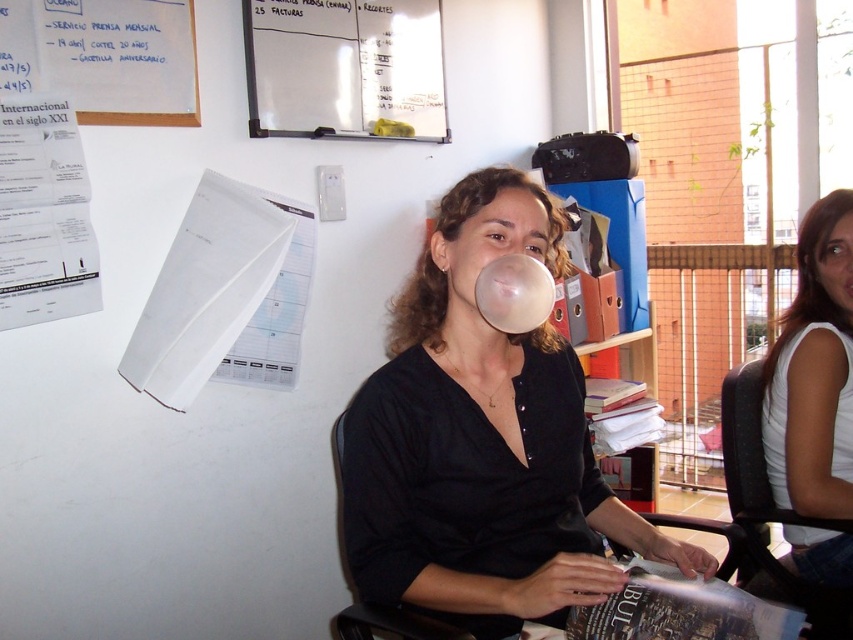
You are a tailor measuring clothes for a customer. You need to determine if the matte black shirt at center and the white cotton tank top at right can be placed side by side on a 1.2 meter wide hanger rack. Can they fit?

The matte black shirt at center and the white cotton tank top at right are 66.42 centimeters apart. Since the total required space is 66.42 cm and the rack is 120 cm wide, they can fit comfortably with extra space remaining.

Consider the image. You are an office worker who needs to sit down. You see the white cotton tank top at right and the black fabric chair at center. Which object is closer to you if you are standing in front of the desk?

The white cotton tank top at right is closer to you because the black fabric chair at center is behind it.

You are organizing a photoshoot in this office and need to position a model near the white cotton tank top at right and the black fabric chair at center. Based on their positions, which object should the model stand closer to if they want to be near both without being too far from either?

The model should stand closer to the black fabric chair at center because the white cotton tank top at right is located to the right of the black fabric chair at center, meaning it is farther away from the chair than the chair itself. By positioning themselves near the chair, they can be in proximity to both objects without being too distant from either.